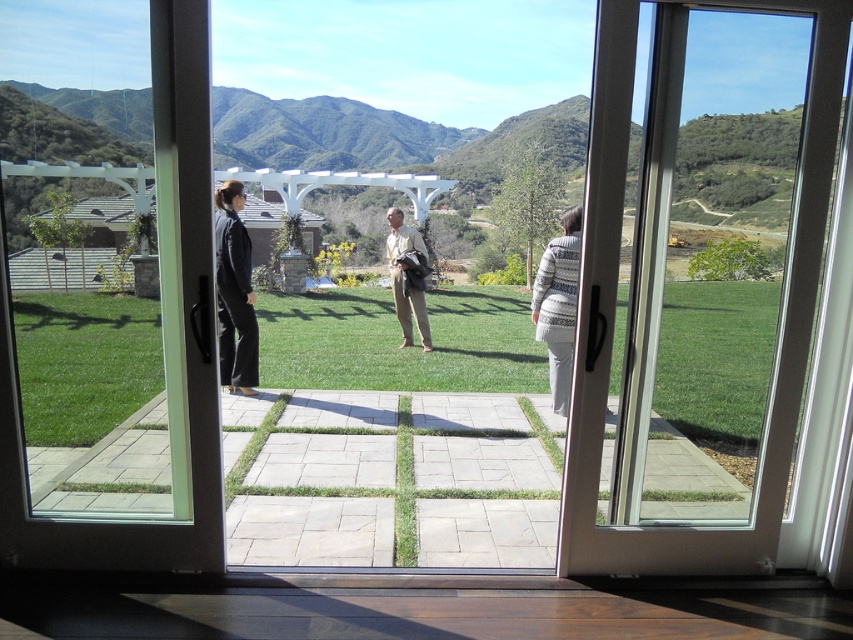
From the picture: You are standing inside a house and want to exit through one of the doors. You notice the white glossy door at right and the clear glass door at center. Which door is closer to you?

The white glossy door at right is closer to you because it is further to the viewer than the clear glass door at center, meaning it is positioned nearer to your current position inside the house.

You are trying to exit through the doors to join the people outside. Which door should you use to exit, the white glossy door at right or the clear glass door at center?

The clear glass door at center is shorter than the white glossy door at right, so you should use the clear glass door at center to exit since it is more likely to be at a comfortable height for passage.